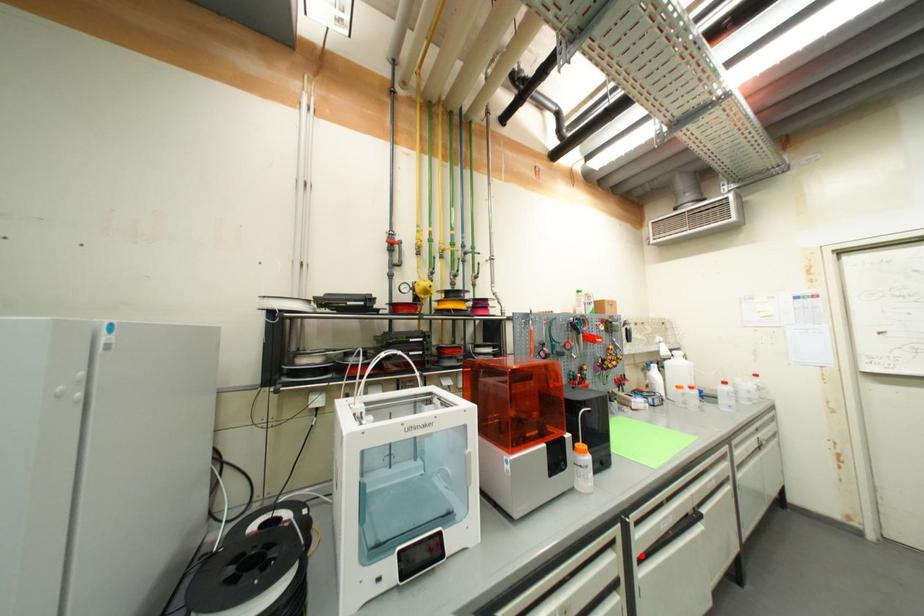
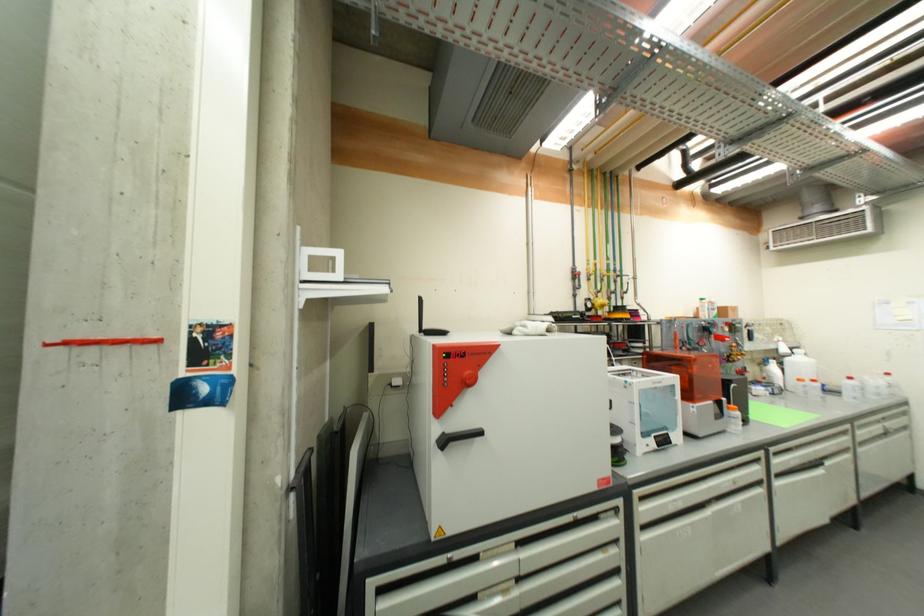
Find the pixel in the second image that matches the highlighted location in the first image.

(779, 472)